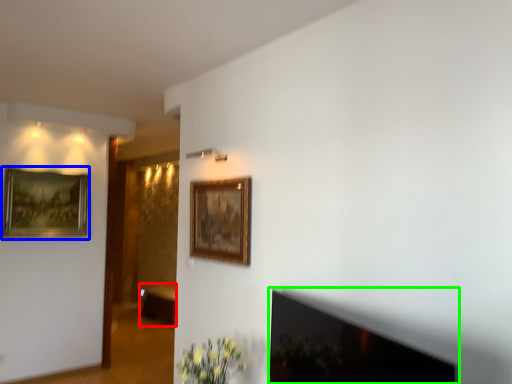
Question: Which object is positioned closest to furniture (highlighted by a red box)? Select from picture frame (highlighted by a blue box) and fireplace (highlighted by a green box).

Choices:
 (A) picture frame
 (B) fireplace

Answer: (A)